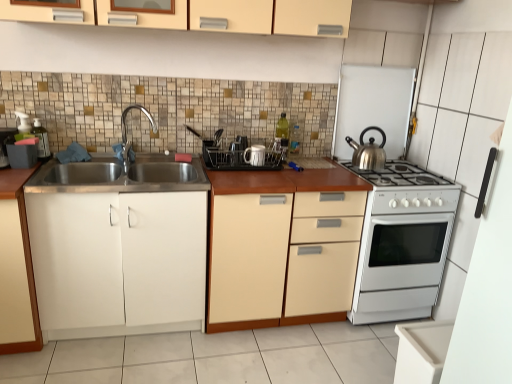
Question: Is clear plastic utensil rack at center, the fourth appliance when ordered from right to left, positioned beyond the bounds of chrome metallic faucet at left?

Choices:
 (A) no
 (B) yes

Answer: (B)

Question: Can you confirm if clear plastic utensil rack at center, the fourth appliance when ordered from right to left, is wider than chrome metallic faucet at left?

Choices:
 (A) no
 (B) yes

Answer: (A)

Question: From a real-world perspective, does clear plastic utensil rack at center, the fourth appliance when ordered from right to left, stand above chrome metallic faucet at left?

Choices:
 (A) no
 (B) yes

Answer: (A)

Question: Is clear plastic utensil rack at center, which ranks as the 2th appliance in left-to-right order, to the left of chrome metallic faucet at left from the viewer's perspective?

Choices:
 (A) yes
 (B) no

Answer: (B)

Question: Is clear plastic utensil rack at center, which ranks as the 2th appliance in left-to-right order, shorter than chrome metallic faucet at left?

Choices:
 (A) yes
 (B) no

Answer: (A)

Question: Is clear plastic utensil rack at center, the fourth appliance when ordered from right to left, taller than chrome metallic faucet at left?

Choices:
 (A) yes
 (B) no

Answer: (B)

Question: Does silver metallic kettle at upper right, which is counted as the 5th appliance, starting from the left, have a lesser width compared to white glossy mug at center, the 4th appliance viewed from the left?

Choices:
 (A) no
 (B) yes

Answer: (A)

Question: Is silver metallic kettle at upper right, which is counted as the 5th appliance, starting from the left, located outside white glossy mug at center, placed as the second appliance when sorted from right to left?

Choices:
 (A) no
 (B) yes

Answer: (B)

Question: From a real-world perspective, is silver metallic kettle at upper right, which is counted as the 5th appliance, starting from the left, physically below white glossy mug at center, the 4th appliance viewed from the left?

Choices:
 (A) no
 (B) yes

Answer: (A)

Question: Would you say silver metallic kettle at upper right, which is counted as the 5th appliance, starting from the left, is a long distance from white glossy mug at center, placed as the second appliance when sorted from right to left?

Choices:
 (A) no
 (B) yes

Answer: (A)

Question: Is silver metallic kettle at upper right, which is counted as the 5th appliance, starting from the left, taller than white glossy mug at center, the 4th appliance viewed from the left?

Choices:
 (A) no
 (B) yes

Answer: (B)

Question: Is the surface of silver metallic kettle at upper right, which is the first appliance from right to left, in direct contact with white glossy mug at center, placed as the second appliance when sorted from right to left?

Choices:
 (A) yes
 (B) no

Answer: (B)

Question: Would you say translucent plastic soap dispenser at left, the 5th appliance viewed from the right, contains black plastic dish rack at center, acting as the third appliance starting from the right?

Choices:
 (A) yes
 (B) no

Answer: (B)